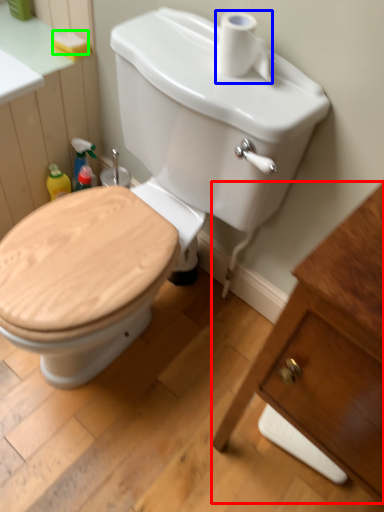
Question: Estimate the real-world distances between objects in this image. Which object is closer to porcelain (highlighted by a red box), toilet paper (highlighted by a blue box) or soap (highlighted by a green box)?

Choices:
 (A) toilet paper
 (B) soap

Answer: (A)